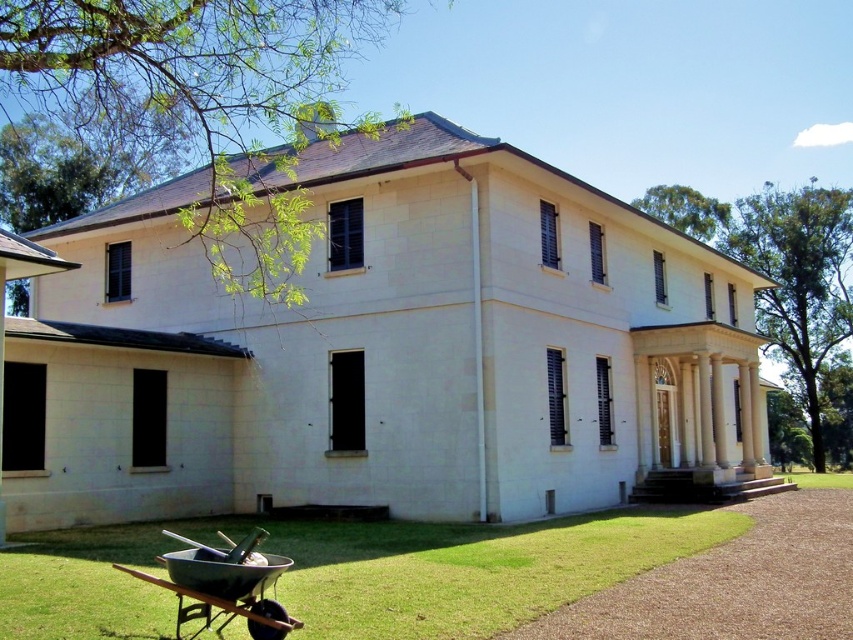
Question: In this image, where is green grass at lower left located relative to metallic wheelbarrow at lower left?

Choices:
 (A) below
 (B) above

Answer: (A)

Question: From the image, what is the correct spatial relationship of green grass at lower left in relation to metallic wheelbarrow at lower left?

Choices:
 (A) below
 (B) above

Answer: (A)

Question: Is green grass at lower left further to camera compared to metallic wheelbarrow at lower left?

Choices:
 (A) no
 (B) yes

Answer: (B)

Question: Which of the following is the farthest from the observer?

Choices:
 (A) metallic wheelbarrow at lower left
 (B) green grass at lower left

Answer: (B)